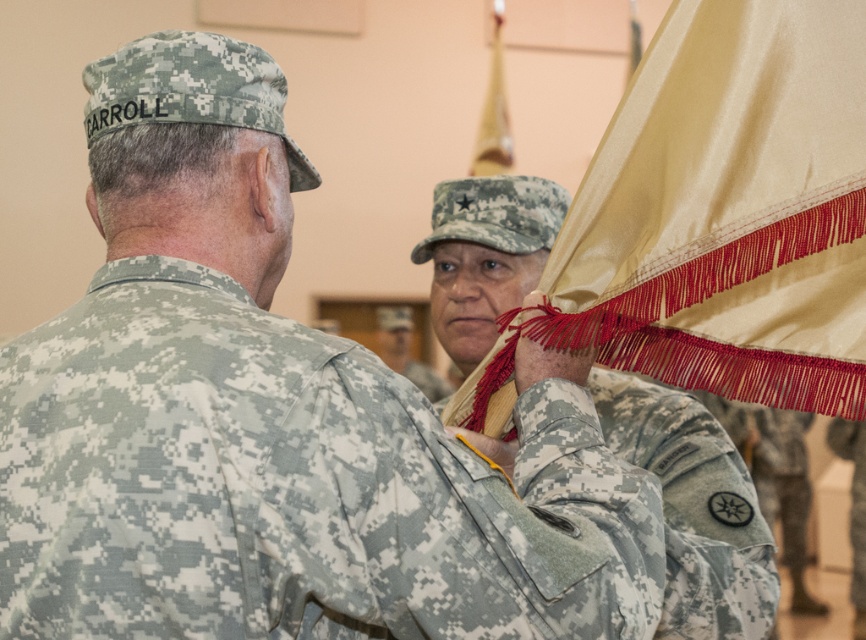
Question: Does camouflage fabric uniform at upper right appear over silky gold flag at upper center?

Choices:
 (A) yes
 (B) no

Answer: (B)

Question: In this image, where is camouflage fabric uniform at upper right located relative to camouflage uniform at center?

Choices:
 (A) below
 (B) above

Answer: (B)

Question: Among these points, which one is farthest from the camera?

Choices:
 (A) (40, 442)
 (B) (645, 276)
 (C) (503, 163)

Answer: (C)

Question: Which point appears closest to the camera in this image?

Choices:
 (A) (507, 170)
 (B) (406, 342)
 (C) (662, 209)

Answer: (C)

Question: Based on their relative distances, which object is nearer to the camouflage fabric flag at center?

Choices:
 (A) satin beige flag at upper right
 (B) camouflage uniform at center
 (C) silky gold flag at upper center

Answer: (A)

Question: Is silky gold flag at upper center bigger than camouflage uniform at center?

Choices:
 (A) yes
 (B) no

Answer: (B)